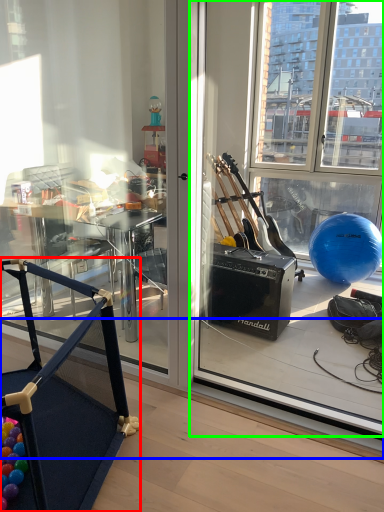
Question: Which is farther away from furniture (highlighted by a red box)? window sill (highlighted by a blue box) or window screen (highlighted by a green box)?

Choices:
 (A) window sill
 (B) window screen

Answer: (B)